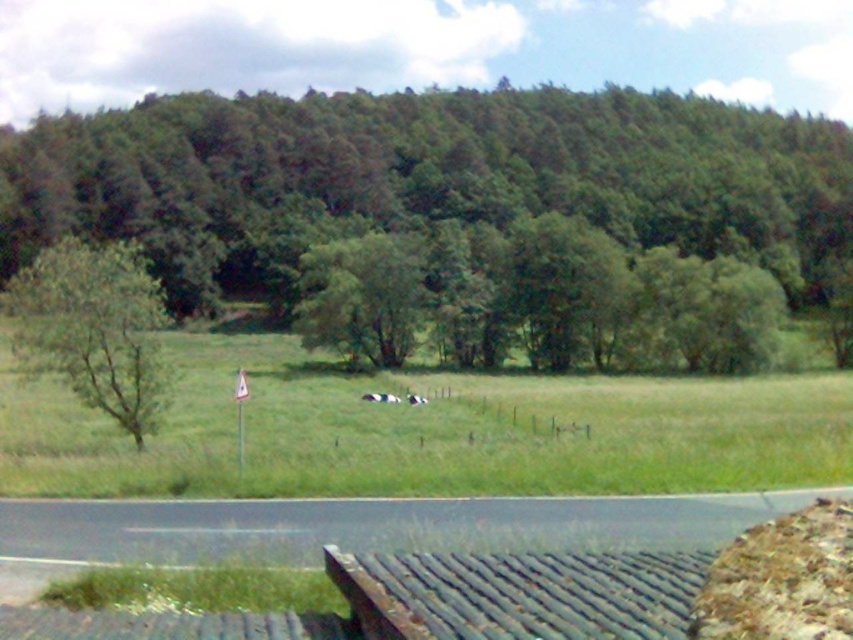
You are standing at the bottom of the image and looking towards the top. Which object is higher in the scene between the green leafy tree at center and the white fluffy sheep at center?

The green leafy tree at center is located above the white fluffy sheep at center, so it is higher in the scene.

You are planning to plant a new tree in the rural landscape. The existing green leafy tree at upper center and the rusty metal bench at lower center are already present. Which object occupies more horizontal space in the image?

The green leafy tree at upper center occupies more horizontal space than the rusty metal bench at lower center because its width is larger.

You are a bird looking for a nesting spot. You see the green leafy tree at upper center and the green leafy tree at left. Which tree has a wider canopy to accommodate your nest?

The green leafy tree at upper center has a wider canopy than the green leafy tree at left, so it can accommodate your nest better.